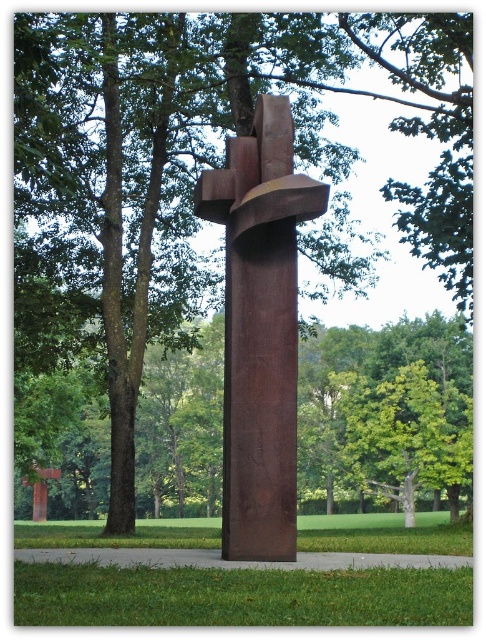
Which of these two, rusty metal sculpture at center or rusty metal cross at lower left, stands shorter?

Standing shorter between the two is rusty metal cross at lower left.

Does rusty metal sculpture at center appear over rusty metal cross at lower left?

Yes.

Between point (254, 504) and point (41, 518), which one is positioned in front?

Point (254, 504)

Find the location of a particular element. rusty metal sculpture at center is located at coordinates point(260,328).